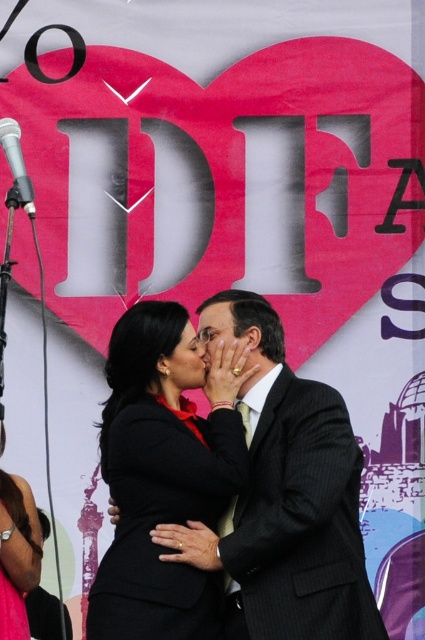
Who is more forward, [186,362] or [20,150]?

Positioned in front is point [186,362].

Does matte black face at center appear on the left side of black plastic microphone at upper left?

In fact, matte black face at center is to the right of black plastic microphone at upper left.

Does point (198, 362) lie behind point (20, 180)?

No, (198, 362) is closer to viewer.

Identify the location of matte black face at center. The height and width of the screenshot is (640, 425). [x=184, y=364].

Between black matte suit at center and matte black face at center, which one is positioned higher?

matte black face at center is above.

Between point (150, 314) and point (181, 337), which one is positioned behind?

The point (150, 314) is behind.

Is point (169, 426) positioned in front of point (176, 388)?

Yes.

The image size is (425, 640). I want to click on black matte suit at center, so click(x=163, y=481).

Where is `black pinstripe suit at center`? The image size is (425, 640). black pinstripe suit at center is located at coordinates (288, 506).

Which is in front, point (286, 444) or point (28, 572)?

Point (286, 444) is more forward.

Who is more forward, (251, 429) or (8, 577)?

Point (251, 429)

Find the location of a particular element. The width and height of the screenshot is (425, 640). black pinstripe suit at center is located at coordinates (288, 506).